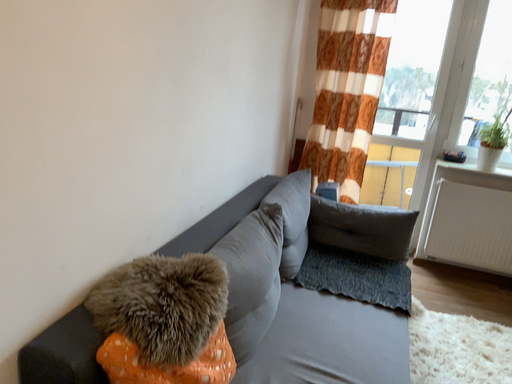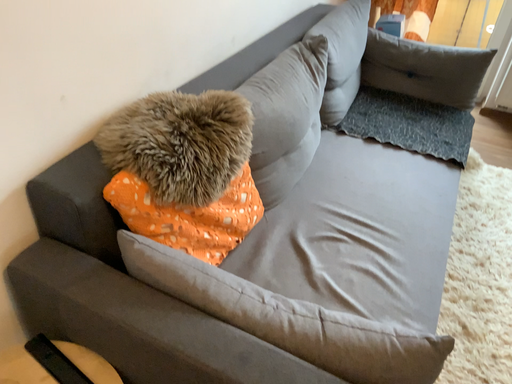
Question: How did the camera likely rotate when shooting the video?

Choices:
 (A) rotated upward
 (B) rotated downward

Answer: (B)